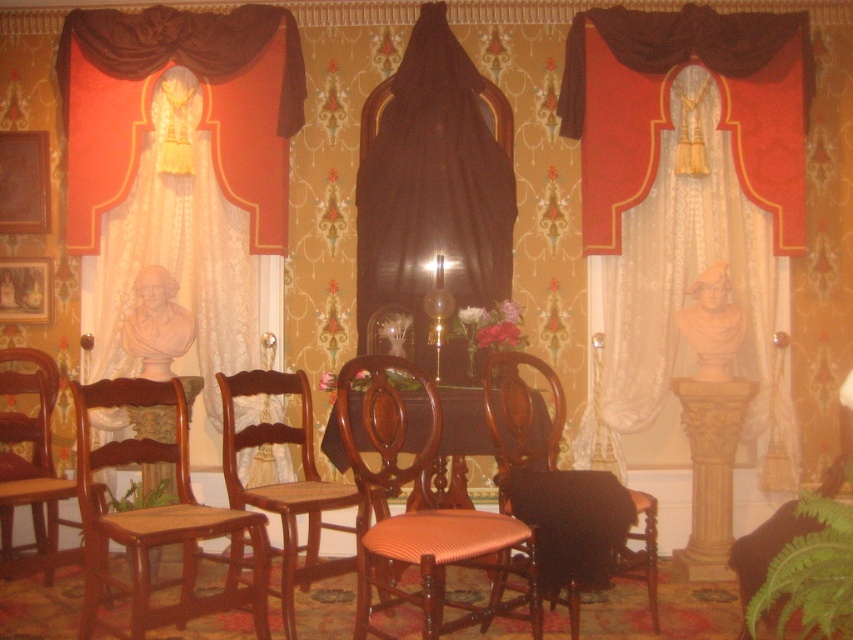
Can you confirm if velvet drapery at center is positioned to the right of wooden chair with woven seat at center?

Indeed, velvet drapery at center is positioned on the right side of wooden chair with woven seat at center.

Which is behind, point (723, 104) or point (216, 376)?

The point (723, 104) is behind.

Who is more forward, (589, 228) or (350, 564)?

Positioned in front is point (350, 564).

The image size is (853, 640). In order to click on velvet drapery at center in this screenshot , I will do `click(668, 108)`.

Is brown wood table at center below wooden chair with woven seat at center?

No.

Who is positioned more to the left, brown wood table at center or wooden chair with woven seat at center?

Positioned to the left is wooden chair with woven seat at center.

The height and width of the screenshot is (640, 853). In order to click on brown wood table at center in this screenshot , I will do [x=424, y=520].

Does wooden armchair at center have a lesser height compared to wooden chair with woven seat at center?

No, wooden armchair at center is not shorter than wooden chair with woven seat at center.

Who is positioned more to the right, wooden armchair at center or wooden chair with woven seat at center?

wooden armchair at center is more to the right.

What do you see at coordinates (524, 424) in the screenshot? I see `wooden armchair at center` at bounding box center [524, 424].

Find the location of a particular element. wooden armchair at center is located at coordinates (524, 424).